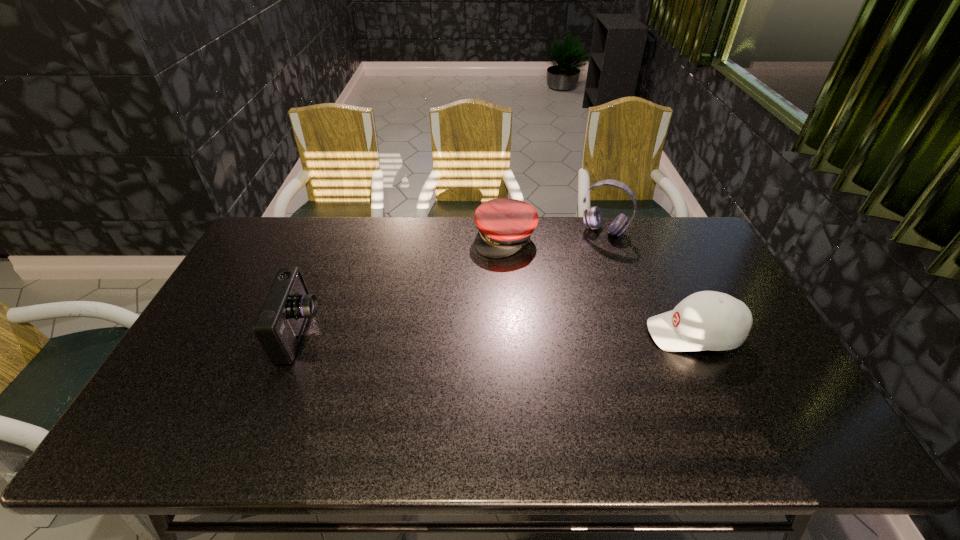
The image size is (960, 540). In order to click on free space on the desktop that is between the third shortest object and the third tallest object and is positioned on the front of the cap with an emblem in this screenshot , I will do `click(460, 333)`.

Identify the location of free space on the desktop that is between the camera and the baseball cap and is positioned on the headband and ear cups of the tallest object. The width and height of the screenshot is (960, 540). (546, 334).